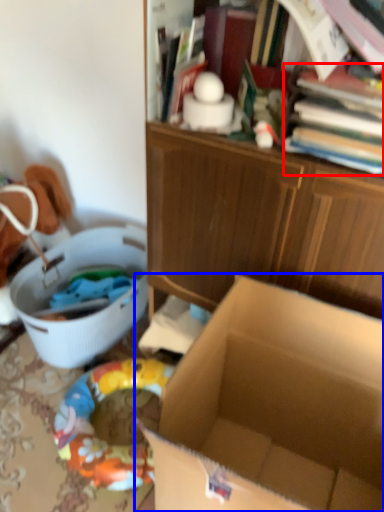
Question: Which of the following is the closest to the observer, book (highlighted by a red box) or box (highlighted by a blue box)?

Choices:
 (A) book
 (B) box

Answer: (B)